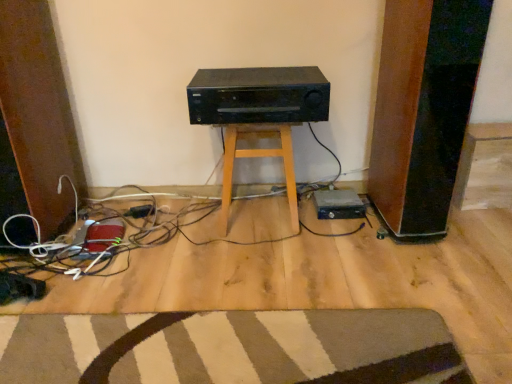
Where is `vacant space that's between black plastic hard drive at lower right and wooden stool at center`? The image size is (512, 384). vacant space that's between black plastic hard drive at lower right and wooden stool at center is located at coordinates (312, 218).